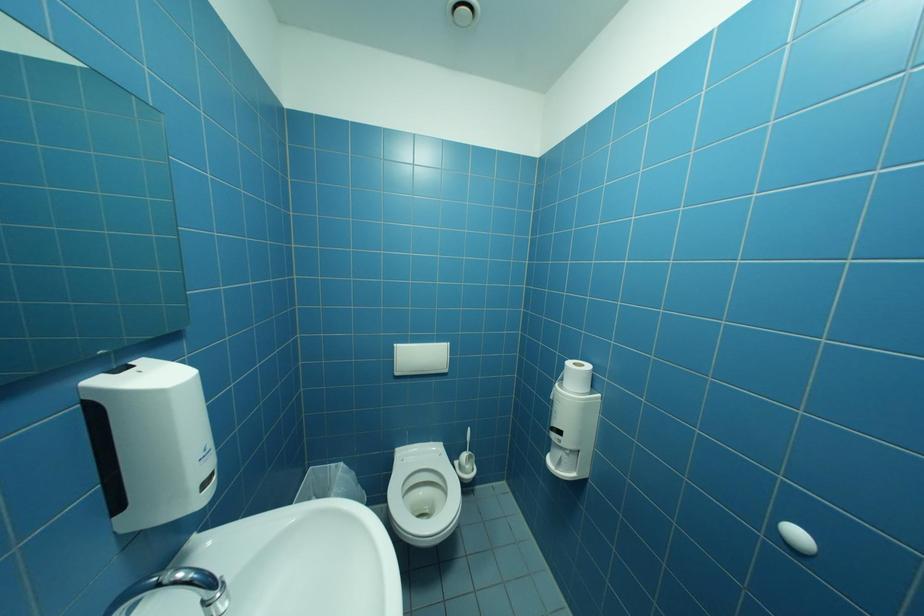
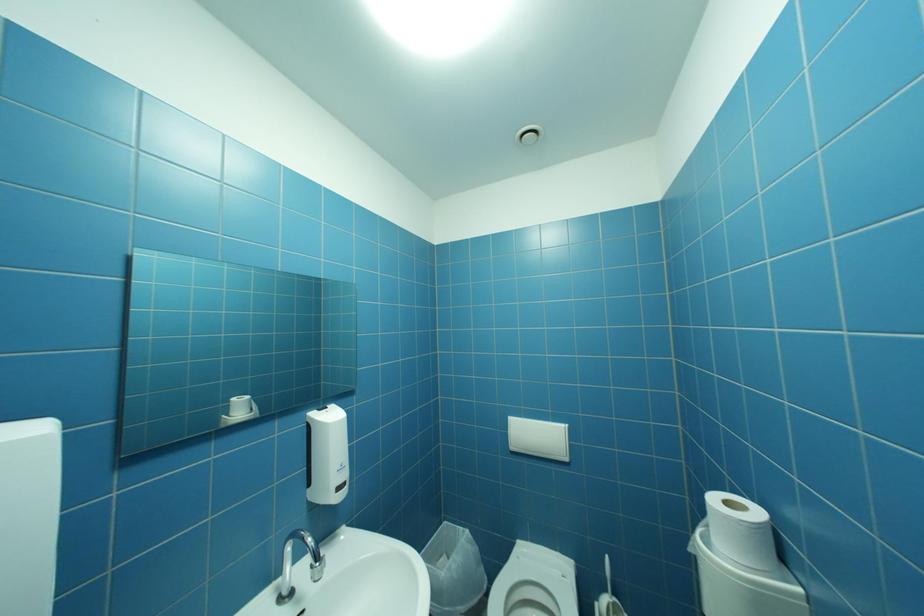
Question: How did the camera likely rotate?

Choices:
 (A) Left
 (B) Right
 (C) Up
 (D) Down

Answer: (A)